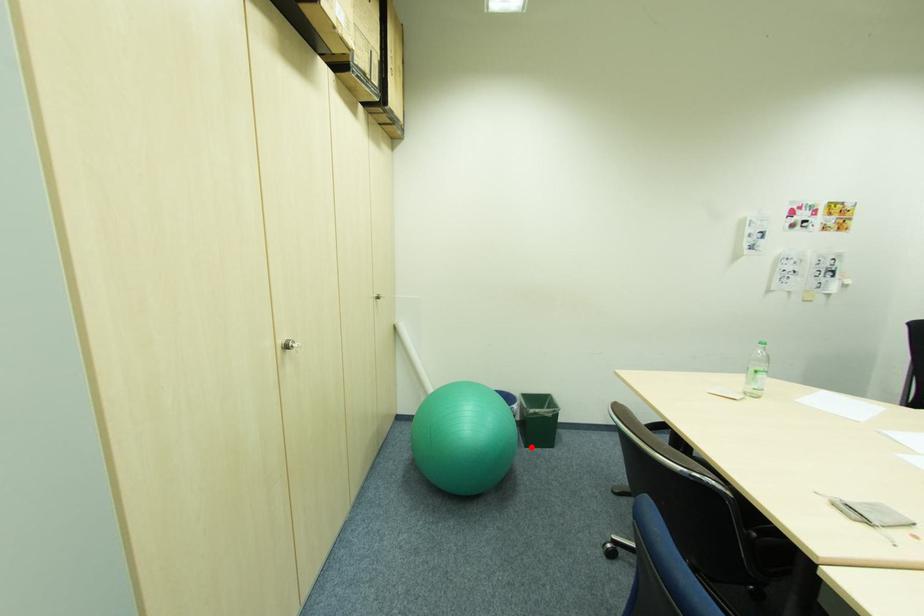
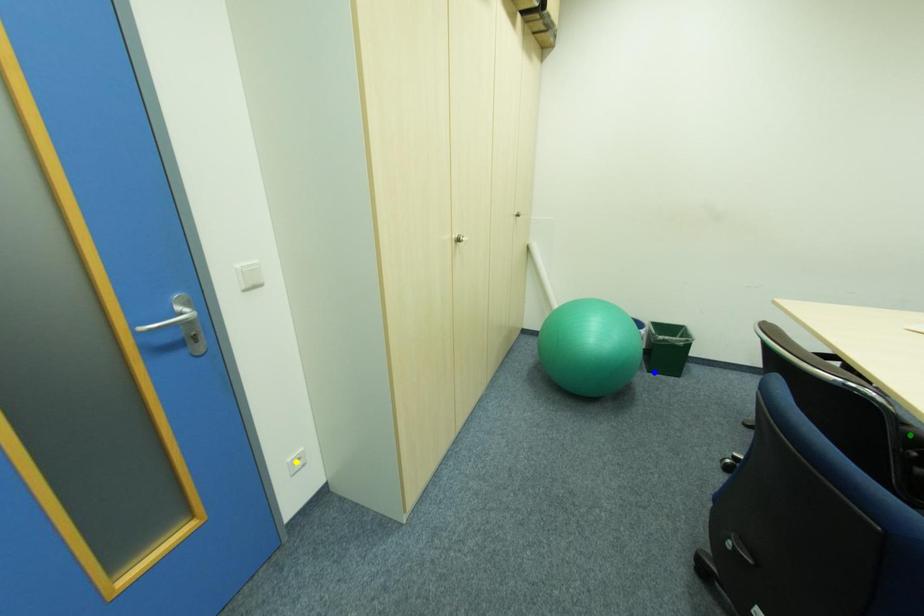
Question: I am providing you with two images of the same scene from different viewpoints. A red point is marked on the first image. You are given multiple points on the second image. Can you choose the point in image 2 that corresponds to the point in image 1?

Choices:
 (A) yellow point
 (B) blue point
 (C) green point

Answer: (B)